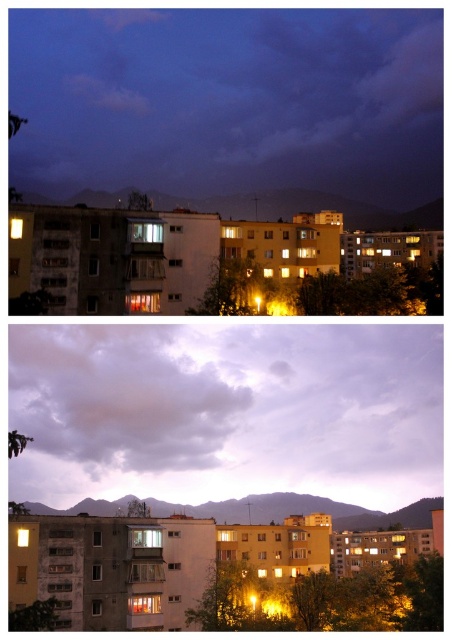
Please provide the 2D coordinates of the gray cotton cloud at upper center in the top photograph of the diptych.

The gray cotton cloud at upper center is located at coordinates (x=117, y=397) in the top photograph.

You are an astronomer observing the night sky through a telescope. You notice two features in the top photograph of the diptych image. One is the cloudy sky at upper center and the other is the gray cotton cloud at upper center. Which of these two features is larger in size?

The cloudy sky at upper center is bigger than the gray cotton cloud at upper center, so the cloudy sky at upper center is larger in size.